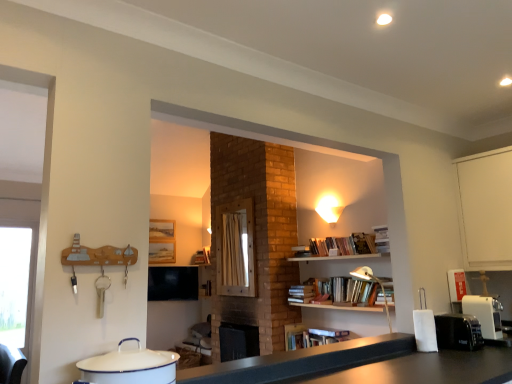
The width and height of the screenshot is (512, 384). I want to click on free spot above wooden frame at center (from a real-world perspective), so pyautogui.click(x=233, y=204).